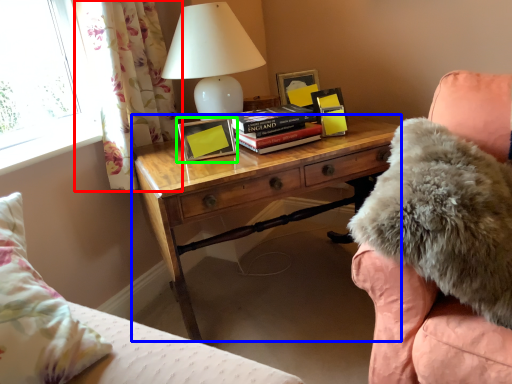
Question: Based on their relative distances, which object is farther from curtain (highlighted by a red box)? Choose from nightstand (highlighted by a blue box) and picture frame (highlighted by a green box).

Choices:
 (A) nightstand
 (B) picture frame

Answer: (A)